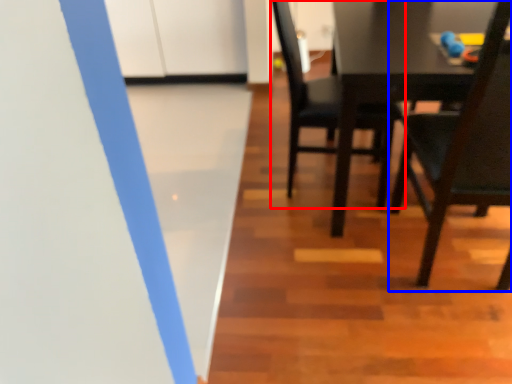
Question: Which of the following is the closest to the observer, chair (highlighted by a red box) or chair (highlighted by a blue box)?

Choices:
 (A) chair
 (B) chair

Answer: (B)